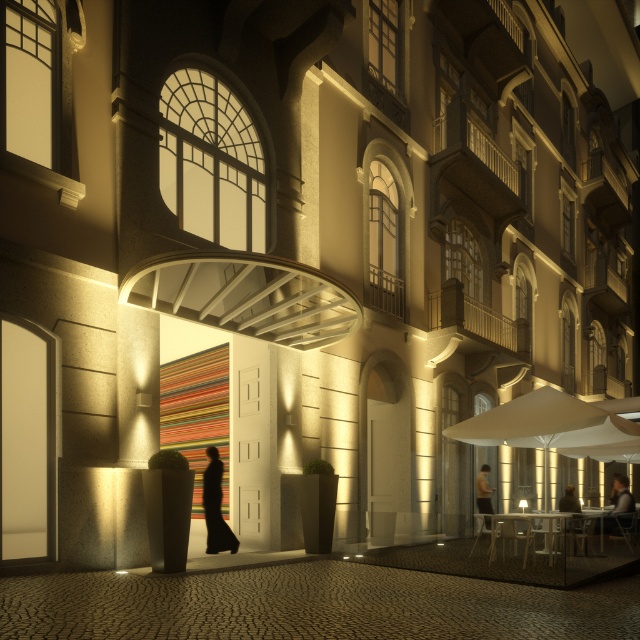
Who is taller, black fabric person at center or dark gray sweater at lower right?

With more height is dark gray sweater at lower right.

Does black fabric person at center appear on the right side of dark gray sweater at lower right?

In fact, black fabric person at center is to the left of dark gray sweater at lower right.

Between point (208, 451) and point (618, 502), which one is positioned in front?

Point (208, 451)

Locate an element on the screen. The width and height of the screenshot is (640, 640). black fabric person at center is located at coordinates 216,506.

Is dark gray sweater at lower right shorter than dark brown leather jacket at lower right?

In fact, dark gray sweater at lower right may be taller than dark brown leather jacket at lower right.

Which of these two, dark gray sweater at lower right or dark brown leather jacket at lower right, stands taller?

dark gray sweater at lower right is taller.

Is point (620, 499) more distant than point (483, 486)?

That is True.

What are the coordinates of `dark gray sweater at lower right` in the screenshot? It's located at click(x=618, y=502).

Does black fabric person at center have a smaller size compared to dark brown leather jacket at lower right?

Incorrect, black fabric person at center is not smaller in size than dark brown leather jacket at lower right.

I want to click on black fabric person at center, so click(x=216, y=506).